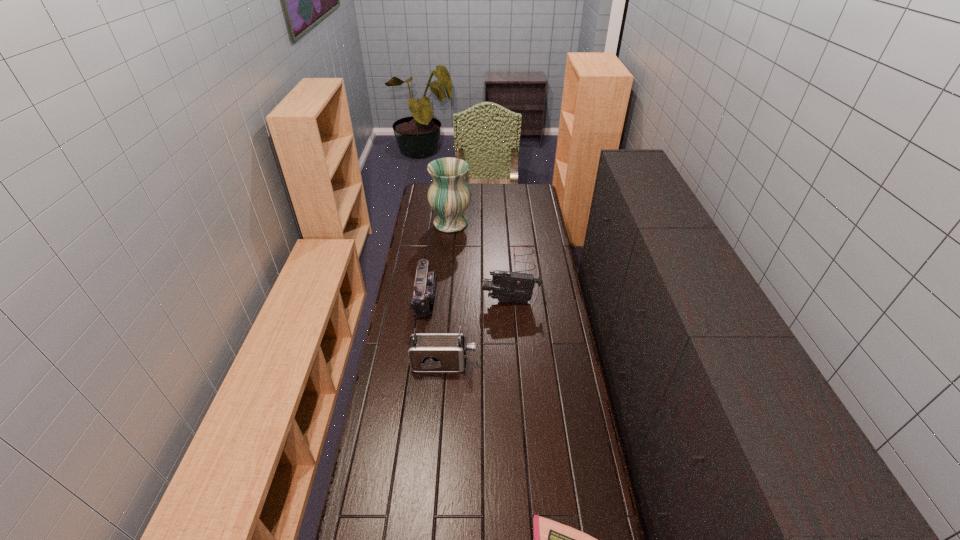
The width and height of the screenshot is (960, 540). I want to click on the tallest object, so click(449, 196).

The height and width of the screenshot is (540, 960). I want to click on the farthest object, so click(449, 196).

I want to click on the fifth farthest object, so click(428, 352).

The width and height of the screenshot is (960, 540). I want to click on the rightmost camcorder, so click(506, 286).

The image size is (960, 540). I want to click on the fourth tallest object, so click(425, 284).

Where is `the second shortest object`? the second shortest object is located at coordinates (515, 246).

I want to click on spectacles, so click(x=515, y=246).

The width and height of the screenshot is (960, 540). I want to click on blank space located 0.290m on the back of the tallest object, so click(454, 187).

Image resolution: width=960 pixels, height=540 pixels. I want to click on vacant space located 0.380m at the lens of the nearest camcorder, so click(572, 364).

You are a GUI agent. You are given a task and a screenshot of the screen. Output one action in this format:
    pyautogui.click(x=<x>, y=<y>)
    Task: Click on the vacant region located on the front-facing side of the rightmost camcorder
    
    Given the screenshot: What is the action you would take?
    pyautogui.click(x=418, y=301)